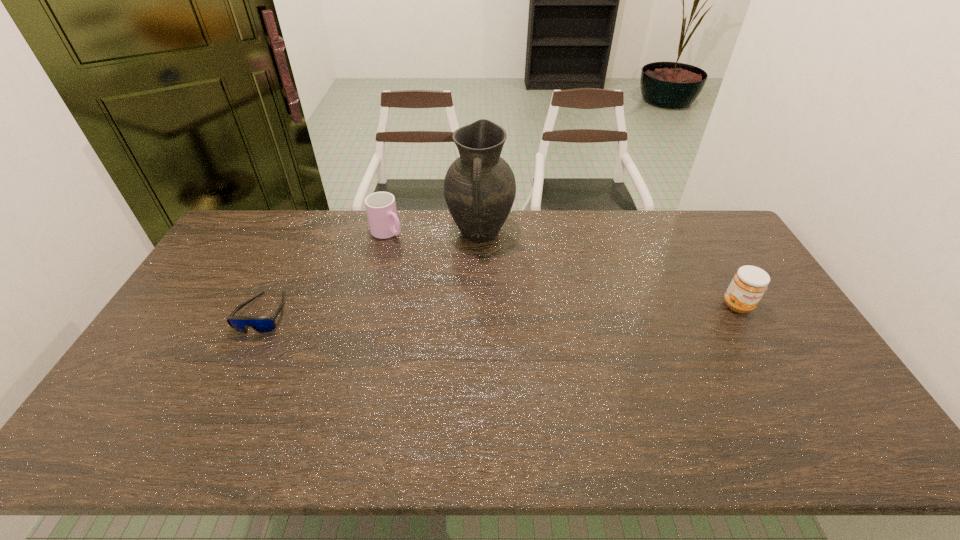
Where is `the leftmost object`? The width and height of the screenshot is (960, 540). the leftmost object is located at coordinates (262, 324).

At what (x,y) coordinates should I click in order to perform the action: click on the shortest object. Please return your answer as a coordinate pair (x, y). The image size is (960, 540). Looking at the image, I should click on (262, 324).

At what (x,y) coordinates should I click in order to perform the action: click on jam. Please return your answer as a coordinate pair (x, y). Looking at the image, I should click on (749, 284).

You are a GUI agent. You are given a task and a screenshot of the screen. Output one action in this format:
    pyautogui.click(x=<x>, y=<y>)
    Task: Click on the pitcher
    This screenshot has height=540, width=960.
    Given the screenshot: What is the action you would take?
    pyautogui.click(x=479, y=187)

You are a GUI agent. You are given a task and a screenshot of the screen. Output one action in this format:
    pyautogui.click(x=<x>, y=<y>)
    Task: Click on the tallest object
    This screenshot has width=960, height=540.
    Given the screenshot: What is the action you would take?
    pyautogui.click(x=479, y=187)

Image resolution: width=960 pixels, height=540 pixels. I want to click on cup, so click(x=381, y=210).

In order to click on free space located 0.230m on the front-facing side of the leftmost object in this screenshot , I will do `click(217, 410)`.

Where is `free space located 0.180m on the front label of the jam`? This screenshot has width=960, height=540. free space located 0.180m on the front label of the jam is located at coordinates (773, 367).

Identify the location of vacant space located on the side of the pitcher with the handle. (469, 326).

In order to click on vacant space located 0.270m on the side of the pitcher with the handle in this screenshot , I will do `click(470, 315)`.